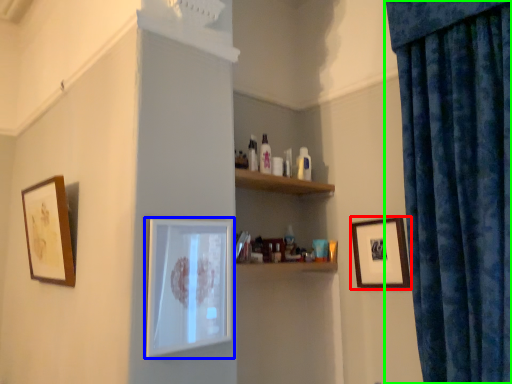
Question: Estimate the real-world distances between objects in this image. Which object is closer to picture frame (highlighted by a red box), picture frame (highlighted by a blue box) or curtain (highlighted by a green box)?

Choices:
 (A) picture frame
 (B) curtain

Answer: (B)